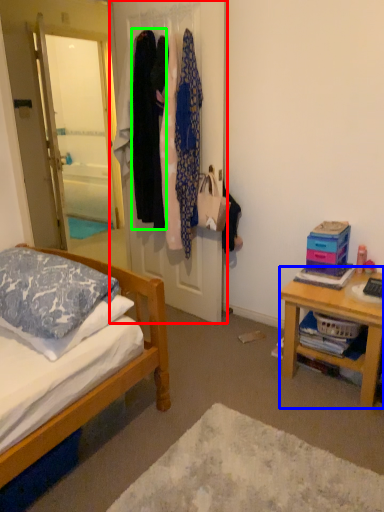
Question: Which object is the farthest from closet (highlighted by a red box)? Choose among these: desk (highlighted by a blue box) or clothing (highlighted by a green box).

Choices:
 (A) desk
 (B) clothing

Answer: (A)